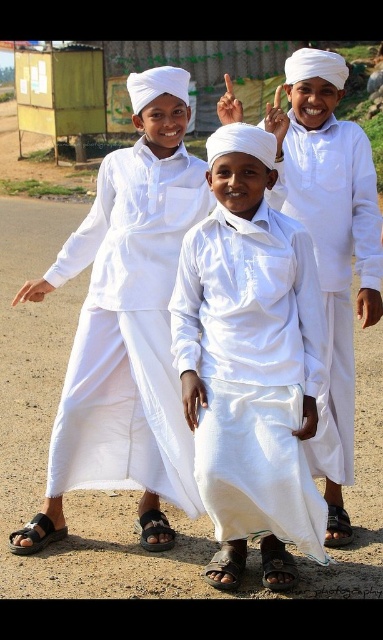
You are a photographer setting up for a group shot. You notice the black leather sandal at lower left and the brown leather sandal at lower center. Which sandal should you avoid placing a small tripod on to ensure stability?

The black leather sandal at lower left has a lesser height compared to the brown leather sandal at lower center, so placing the tripod on the taller brown leather sandal at lower center would provide better stability.

You are a photographer trying to capture the boys pointing upwards. You notice two points marked in the image. The first point is at coordinates point (34, 548) and the second point is at point (162, 522). Which point is closer to the camera?

Point (34, 548) is in front of point (162, 522), so it is closer to the camera.